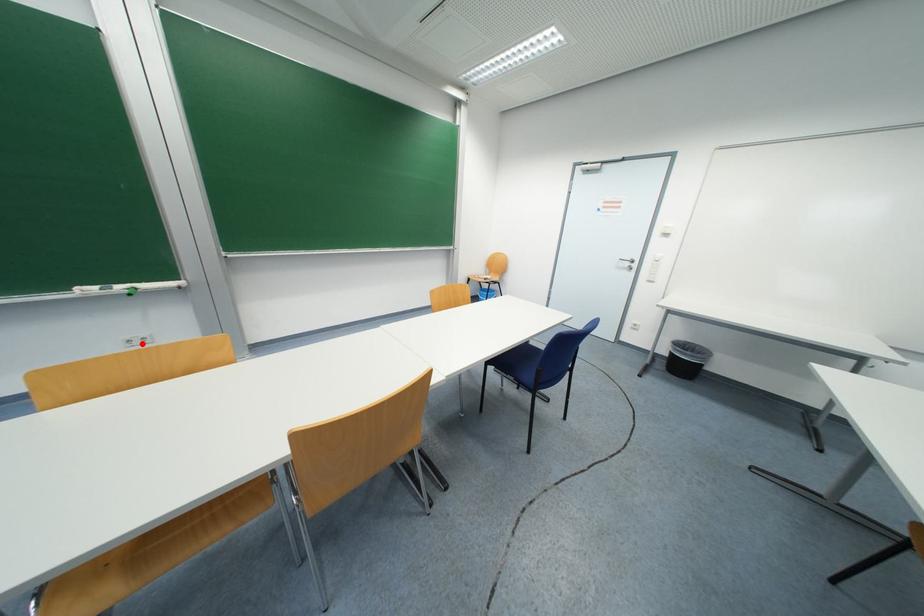
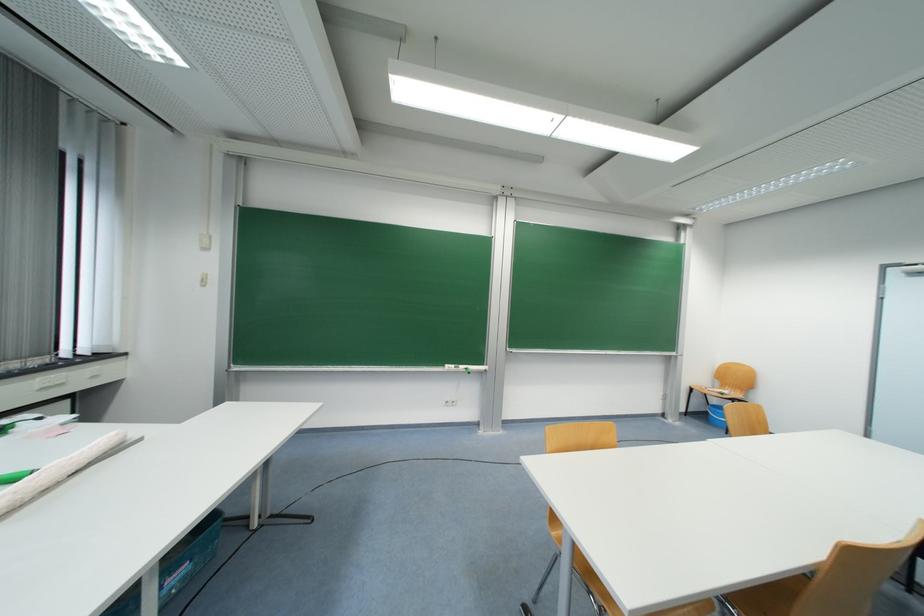
Where in the second image is the point corresponding to the highlighted location from the first image?

(455, 406)